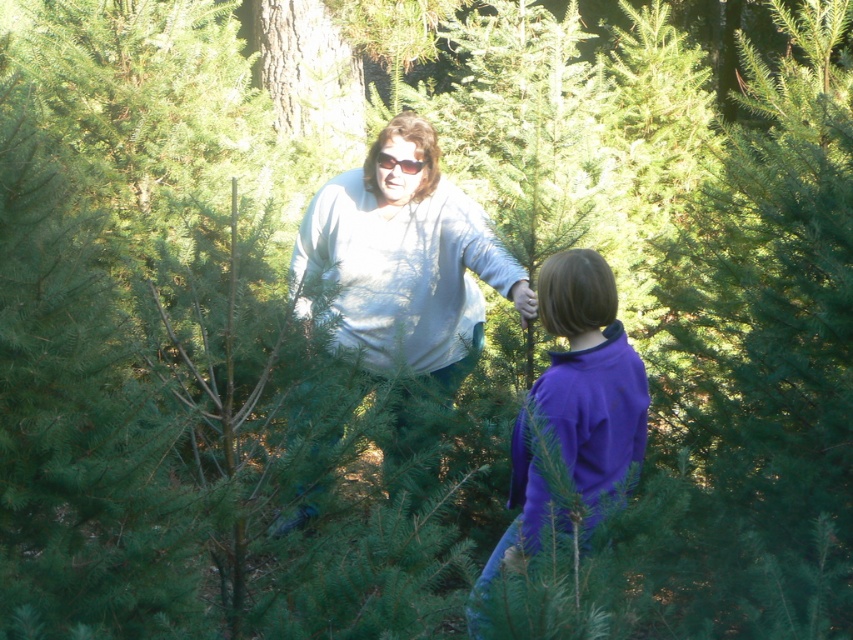
You are a delivery robot trying to locate the white matte sweater at center in the image. According to the coordinates provided, where would you find it?

The white matte sweater at center is located at the coordinates point (405,259).

You are trying to identify two people in a Christmas tree farm scene. There is a person wearing a white matte sweater at center and another wearing a purple fleece jacket at center. Which clothing item is located to the left of the other?

The white matte sweater at center is positioned on the left side of purple fleece jacket at center.

You are a photographer planning to take a portrait of the two people wearing the white matte sweater at center and the purple fleece jacket at center. To ensure both are fully visible, should you adjust your position to face them from the front or the side?

Since the purple fleece jacket at center is behind the white matte sweater at center, you should position yourself to face them from the side to avoid one blocking the other.